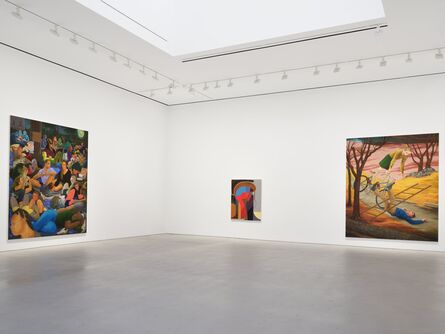
The height and width of the screenshot is (334, 445). What are the coordinates of `oil painting` in the screenshot? It's located at (63, 166), (250, 195), (398, 188).